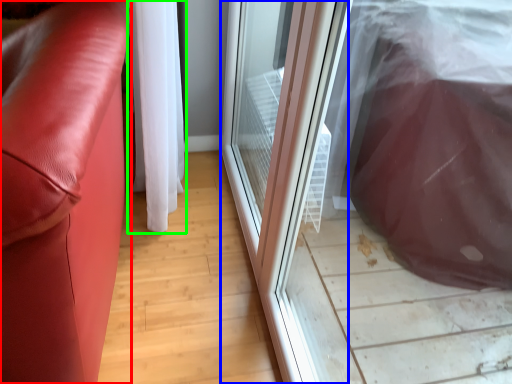
Question: Estimate the real-world distances between objects in this image. Which object is closer to furniture (highlighted by a red box), screen door (highlighted by a blue box) or curtain (highlighted by a green box)?

Choices:
 (A) screen door
 (B) curtain

Answer: (B)